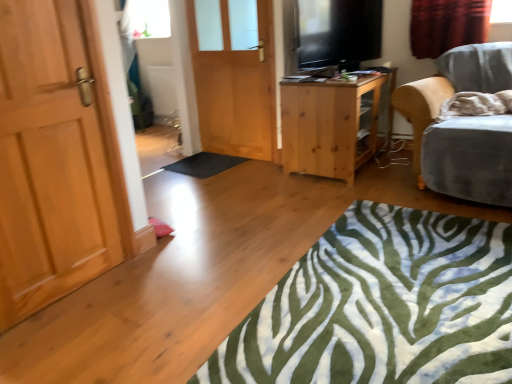
Find the location of `free spot below flat screen tv at upper right (from a real-world perspective)`. free spot below flat screen tv at upper right (from a real-world perspective) is located at coordinates (346, 69).